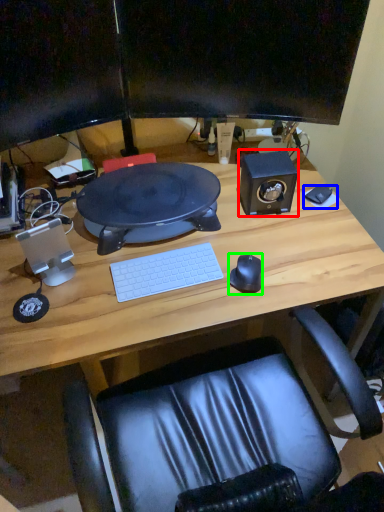
Question: Estimate the real-world distances between objects in this image. Which object is closer to speaker (highlighted by a red box), mousepad (highlighted by a blue box) or mouse (highlighted by a green box)?

Choices:
 (A) mousepad
 (B) mouse

Answer: (A)